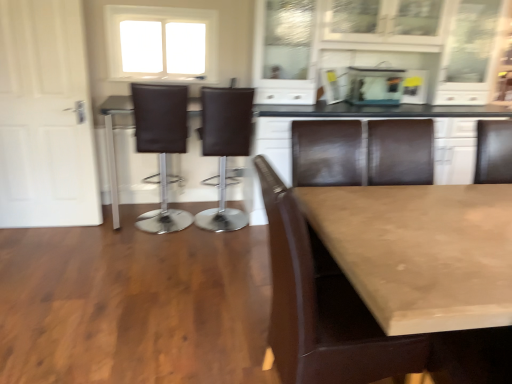
Find the location of `vacant region in front of brown leather bar stool at center, which is the 3th chair in right-to-left order`. vacant region in front of brown leather bar stool at center, which is the 3th chair in right-to-left order is located at coordinates 151,253.